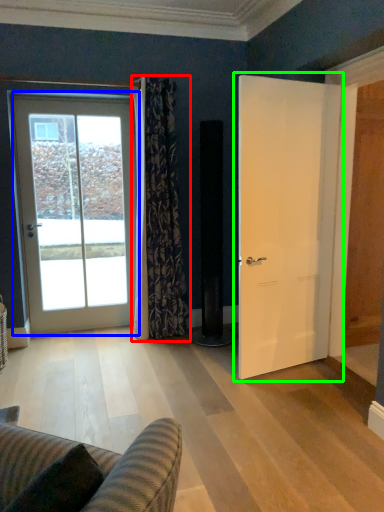
Question: Which object is positioned farthest from curtain (highlighted by a red box)? Select from door (highlighted by a blue box) and door (highlighted by a green box).

Choices:
 (A) door
 (B) door

Answer: (B)